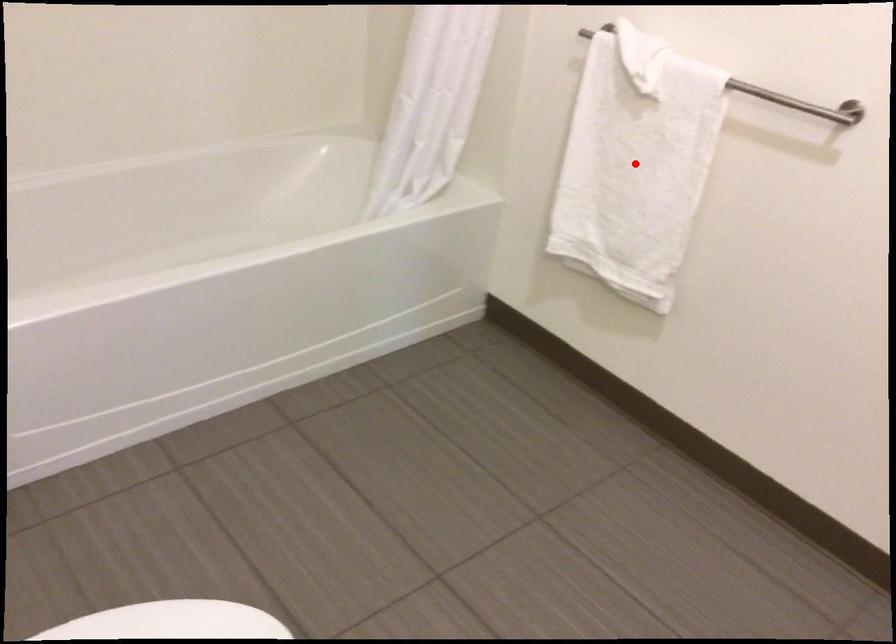
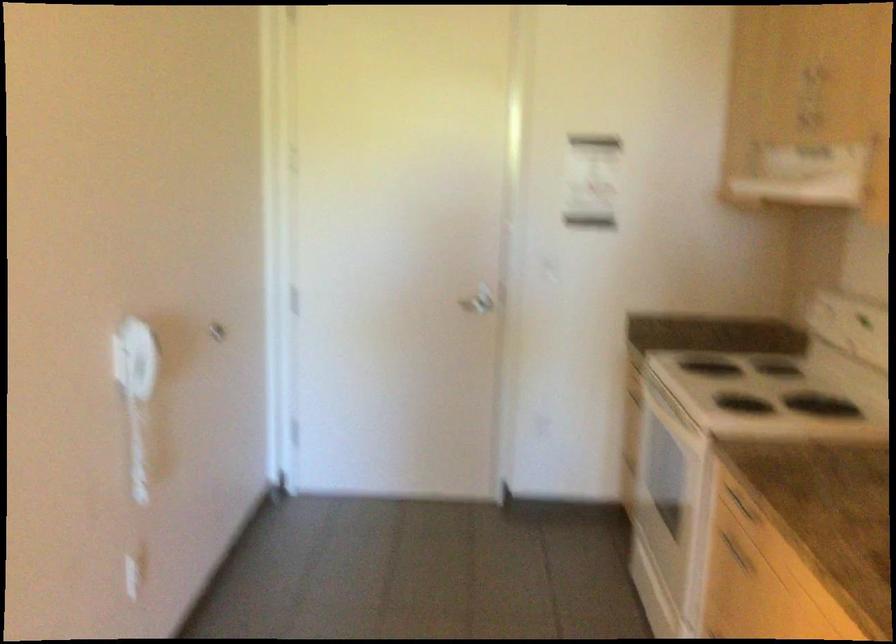
Question: I am providing you with two images of the same scene from different viewpoints. A red point is marked on the first image. At the location where the point appears in image 1, is it still visible in image 2?

Choices:
 (A) Yes
 (B) No

Answer: (B)